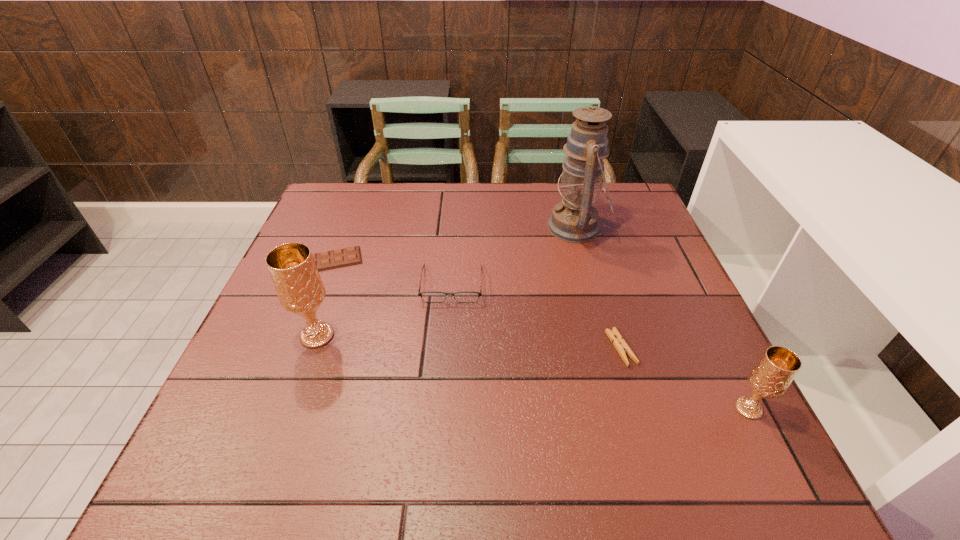
To make them evenly spaced by inserting another chalice among them, please locate a free space for this new chalice. Please provide its 2D coordinates. Your answer should be formatted as a tuple, i.e. [(x, y)], where the tuple contains the x and y coordinates of a point satisfying the conditions above.

[(517, 369)]